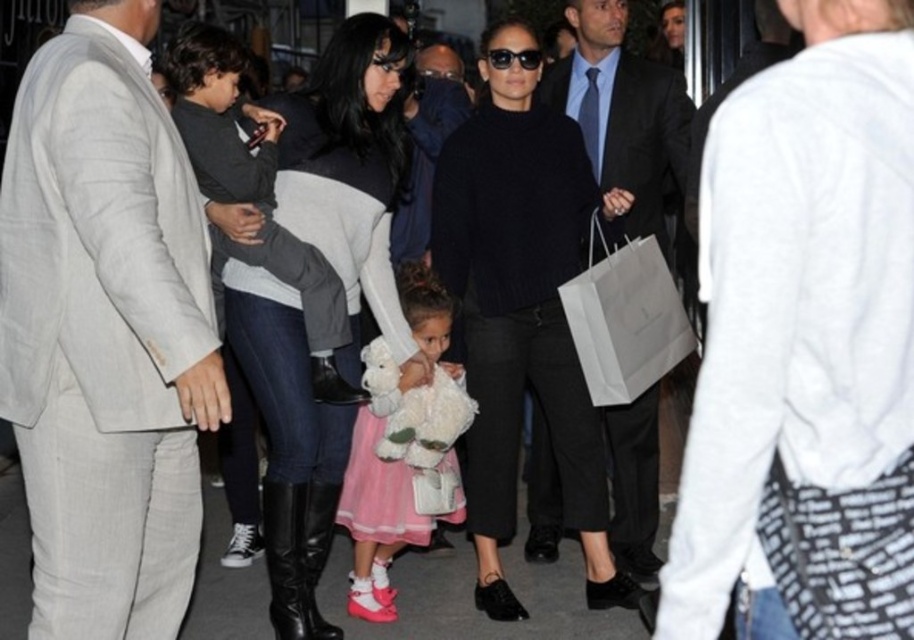
You are standing in a public area and see two people wearing sweaters at the center of the scene. Which sweater is closer to you, the black knit sweater at center or the dark gray sweater at center?

The black knit sweater at center is closer to you because it is further to the viewer than the dark gray sweater at center.

You are a photographer trying to capture a candid shot of the scene. You notice the white cotton shirt at upper right and the black wool sweater at center. Which clothing item should you focus on to ensure it appears larger in your photo?

The white cotton shirt at upper right is much taller than the black wool sweater at center, so focusing on it will make it appear larger in the photo.

Looking at this image, you are organizing a charity event and need to sort donated sweaters by size. You have two sweaters in front of you labeled as black knit sweater at center and dark gray sweater at center. Which one should you place in the large size bin?

The black knit sweater at center should be placed in the large size bin because it is larger in size than the dark gray sweater at center.